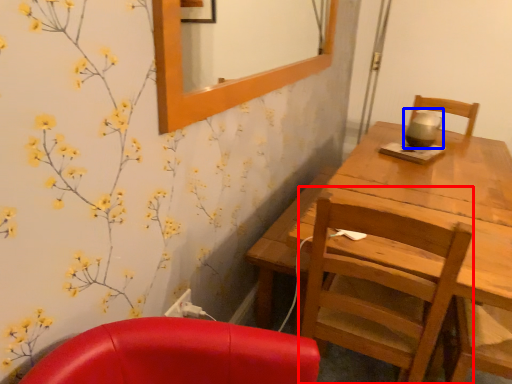
Question: Which point is further to the camera, chair (highlighted by a red box) or tea pot (highlighted by a blue box)?

Choices:
 (A) chair
 (B) tea pot

Answer: (B)